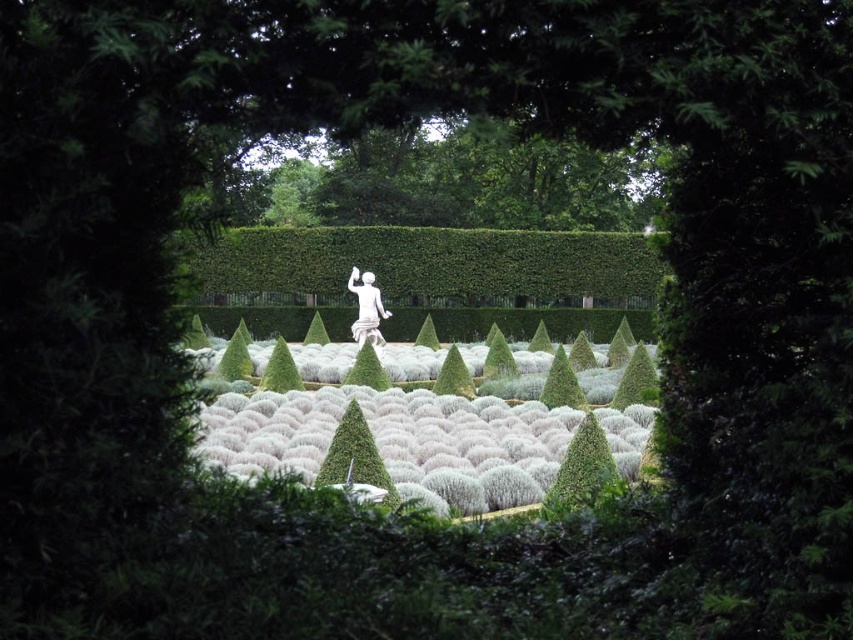
Question: Which point is closer to the camera taking this photo?

Choices:
 (A) (369, 291)
 (B) (238, 275)
 (C) (606, 452)

Answer: (C)

Question: Is green leafy hedge at center bigger than green leafy bush at center?

Choices:
 (A) yes
 (B) no

Answer: (A)

Question: Which of the following is the farthest from the observer?

Choices:
 (A) green textured bush at center
 (B) white marble statue at center
 (C) green leafy hedge at center

Answer: (B)

Question: Which object is farther from the camera taking this photo?

Choices:
 (A) green textured bush at center
 (B) green leafy hedge at center
 (C) white marble statue at center
 (D) green leafy bush at center

Answer: (C)

Question: Considering the relative positions of green leafy bush at center and white marble statue at center in the image provided, where is green leafy bush at center located with respect to white marble statue at center?

Choices:
 (A) left
 (B) right

Answer: (B)

Question: Is green leafy hedge at center above white marble statue at center?

Choices:
 (A) yes
 (B) no

Answer: (A)